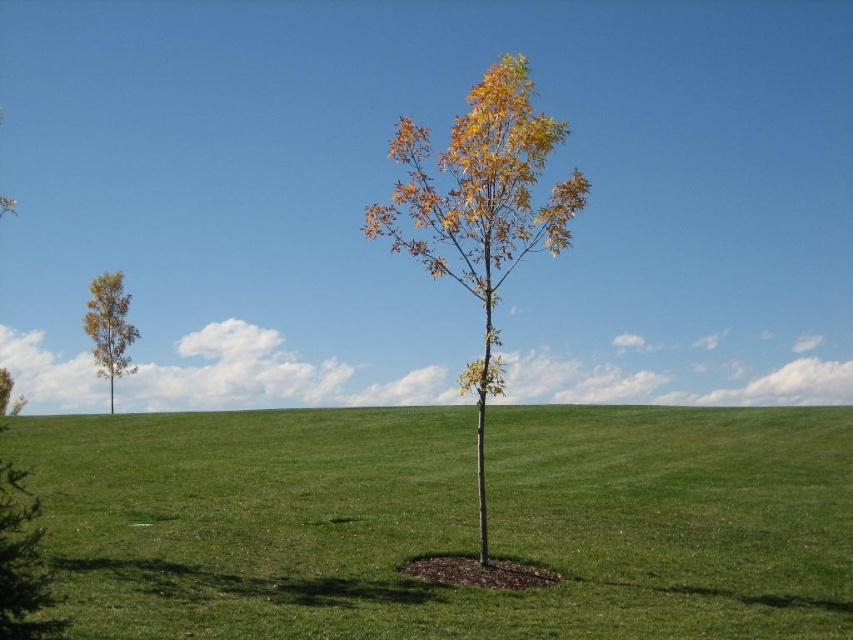
Who is shorter, green grassy at center or smooth brown tree at left?

green grassy at center

This screenshot has height=640, width=853. I want to click on green grassy at center, so pyautogui.click(x=447, y=522).

In the scene shown: Who is higher up, yellow-green foliage at center or smooth brown tree at left?

yellow-green foliage at center

Is yellow-green foliage at center below smooth brown tree at left?

No, yellow-green foliage at center is not below smooth brown tree at left.

Between point (460, 148) and point (125, 365), which one is positioned behind?

Point (125, 365)

This screenshot has height=640, width=853. I want to click on yellow-green foliage at center, so click(x=480, y=211).

Does green grassy at center have a greater height compared to yellow-green foliage at center?

Incorrect, green grassy at center's height is not larger of yellow-green foliage at center's.

Who is lower down, green grassy at center or yellow-green foliage at center?

green grassy at center is lower down.

Which is in front, point (589, 433) or point (555, 241)?

Point (555, 241) is in front.

Where is `green grassy at center`? This screenshot has width=853, height=640. green grassy at center is located at coordinates (447, 522).